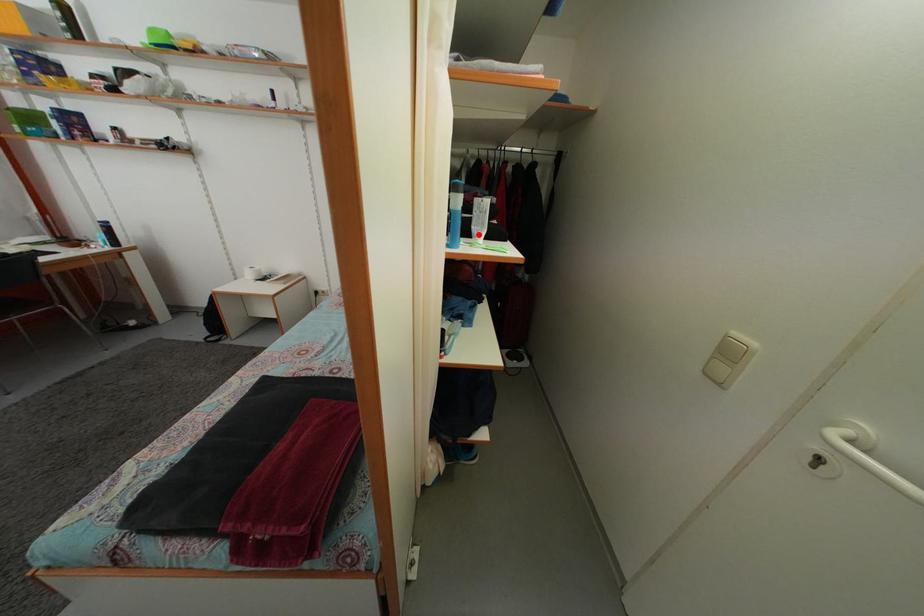
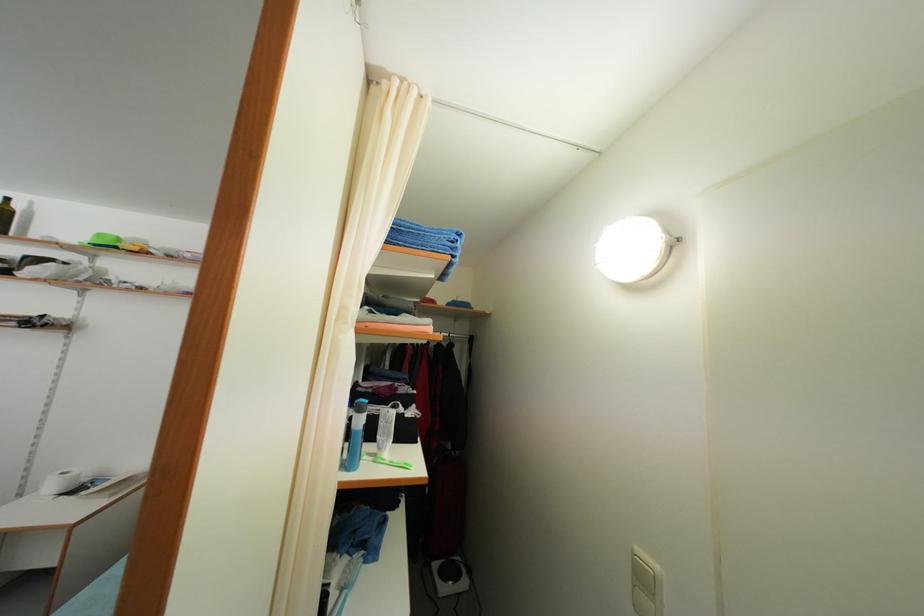
Find the pixel in the second image that matches the highlighted location in the first image.

(383, 445)